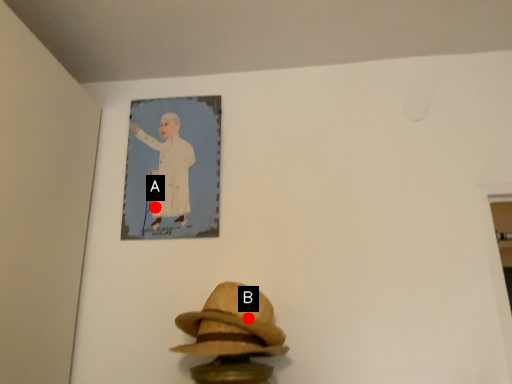
Question: Two points are circled on the image, labeled by A and B beside each circle. Which of the following is the farthest from the observer?

Choices:
 (A) A is further
 (B) B is further

Answer: (A)